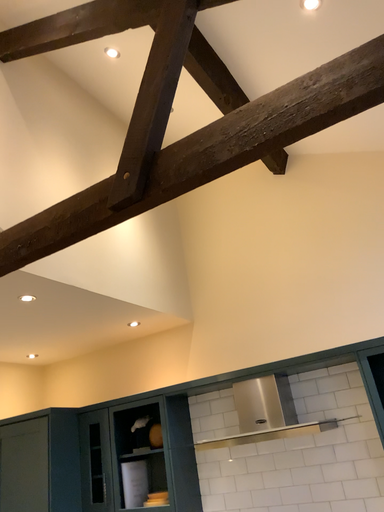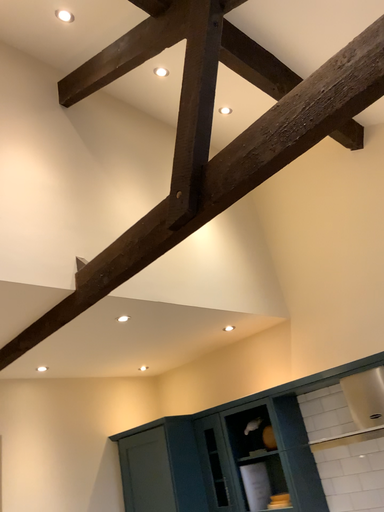
Question: Which way did the camera rotate in the video?

Choices:
 (A) rotated left
 (B) rotated right

Answer: (A)